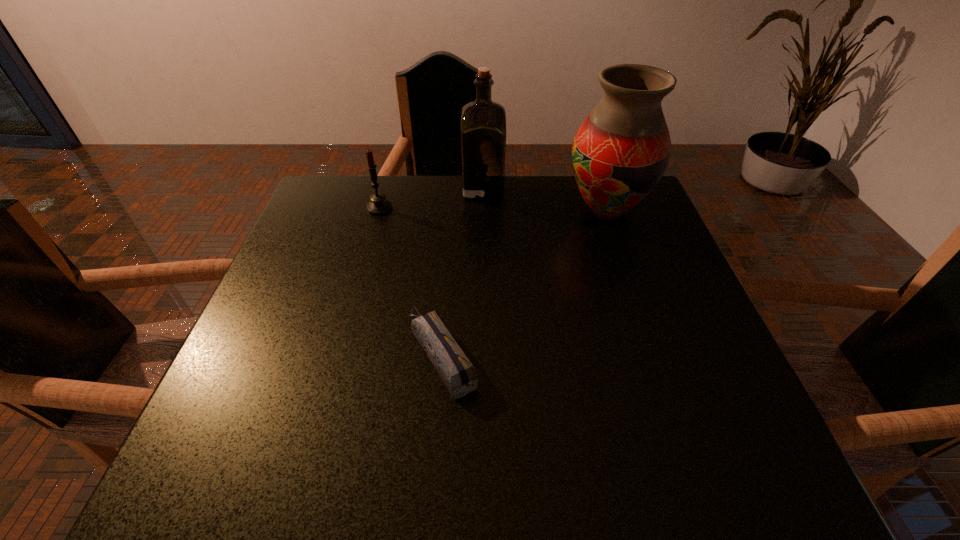
Image resolution: width=960 pixels, height=540 pixels. I want to click on vacant region located 0.370m on the front of the second shortest object, so click(347, 324).

This screenshot has width=960, height=540. Identify the location of vacant area situated on the left of the pencil box. 348,355.

Identify the location of vase at the far edge. The height and width of the screenshot is (540, 960). (620, 152).

Identify the location of liquor that is at the far edge. (483, 122).

The height and width of the screenshot is (540, 960). Identify the location of candle present at the far edge. (379, 205).

You are a GUI agent. You are given a task and a screenshot of the screen. Output one action in this format:
    pyautogui.click(x=<x>, y=<y>)
    Task: Click on the object that is at the left edge
    The image size is (960, 540).
    Given the screenshot: What is the action you would take?
    pyautogui.click(x=379, y=205)

Locate an element on the screen. object at the right edge is located at coordinates (620, 152).

Where is `object located at the far left corner`? The height and width of the screenshot is (540, 960). object located at the far left corner is located at coordinates (379, 205).

Locate an element on the screen. The width and height of the screenshot is (960, 540). object located at the far right corner is located at coordinates tap(620, 152).

In the image, there is a desktop. What are the coordinates of `vacant region at the far edge` in the screenshot? It's located at (423, 180).